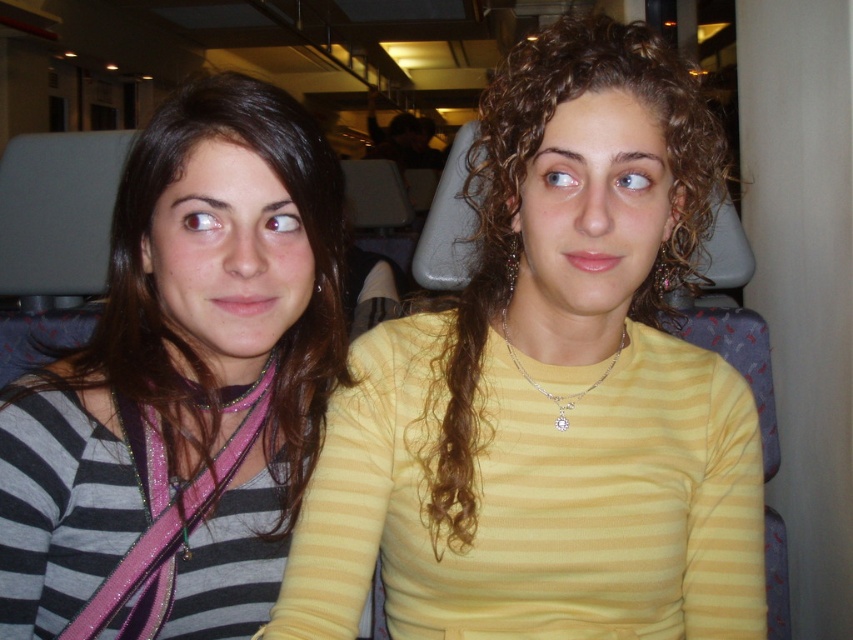
Can you confirm if yellow striped shirt at center is positioned below striped fabric shirt at left?

No, yellow striped shirt at center is not below striped fabric shirt at left.

Between yellow striped shirt at center and striped fabric shirt at left, which one has more height?

yellow striped shirt at center

Locate an element on the screen. yellow striped shirt at center is located at coordinates (550, 392).